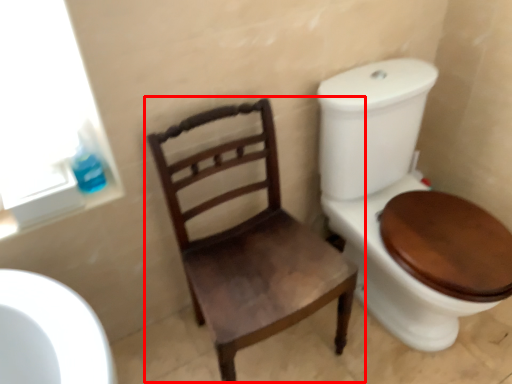
Question: Observing the image, what is the correct spatial positioning of chair (annotated by the red box) in reference to toilet paper?

Choices:
 (A) left
 (B) right

Answer: (B)